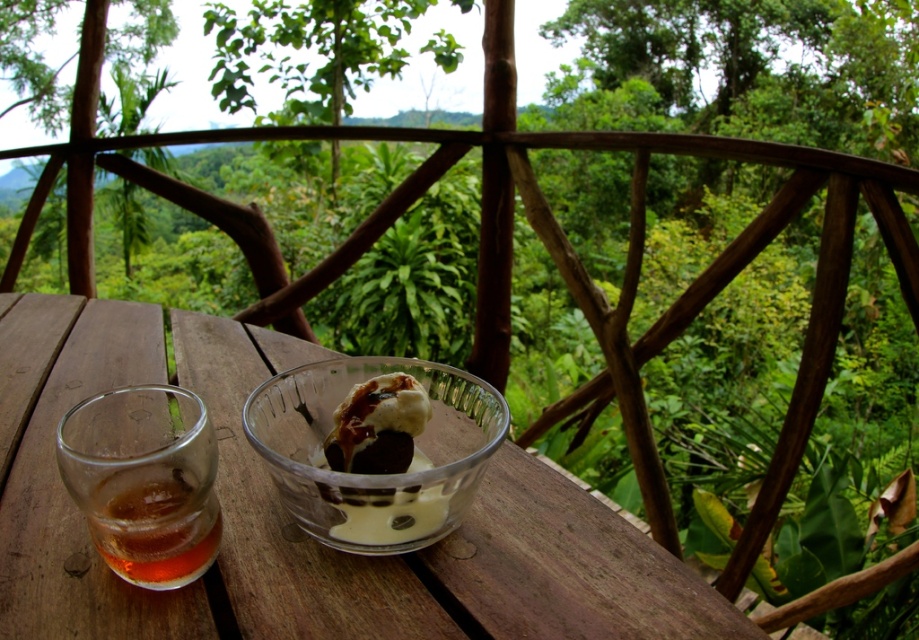
Does transparent glass table at center appear on the right side of amber liquid glass at left?

Incorrect, transparent glass table at center is not on the right side of amber liquid glass at left.

Can you confirm if transparent glass table at center is wider than amber liquid glass at left?

Indeed, transparent glass table at center has a greater width compared to amber liquid glass at left.

The height and width of the screenshot is (640, 919). What do you see at coordinates (293, 525) in the screenshot?
I see `transparent glass table at center` at bounding box center [293, 525].

Find the location of a particular element. transparent glass table at center is located at coordinates (293, 525).

Who is more distant from viewer, (85, 497) or (393, 522)?

The point (393, 522) is more distant.

Where is `amber liquid glass at left`? amber liquid glass at left is located at coordinates (144, 481).

Find the location of a particular element. This screenshot has width=919, height=640. amber liquid glass at left is located at coordinates click(x=144, y=481).

Who is taller, transparent glass table at center or translucent glass bowl at center?

With more height is transparent glass table at center.

Who is positioned more to the right, transparent glass table at center or translucent glass bowl at center?

From the viewer's perspective, translucent glass bowl at center appears more on the right side.

Which is behind, point (650, 557) or point (400, 458)?

The point (650, 557) is behind.

I want to click on transparent glass table at center, so click(293, 525).